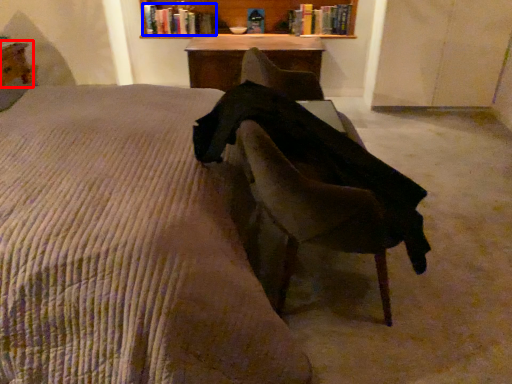
Question: Which of the following is the farthest to the observer, table (highlighted by a red box) or book (highlighted by a blue box)?

Choices:
 (A) table
 (B) book

Answer: (B)